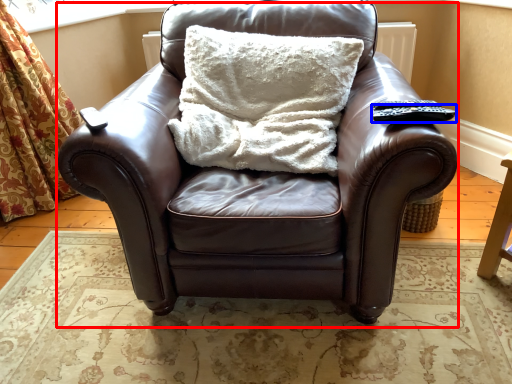
Question: Which point is closer to the camera, chair (highlighted by a red box) or remote (highlighted by a blue box)?

Choices:
 (A) chair
 (B) remote

Answer: (A)